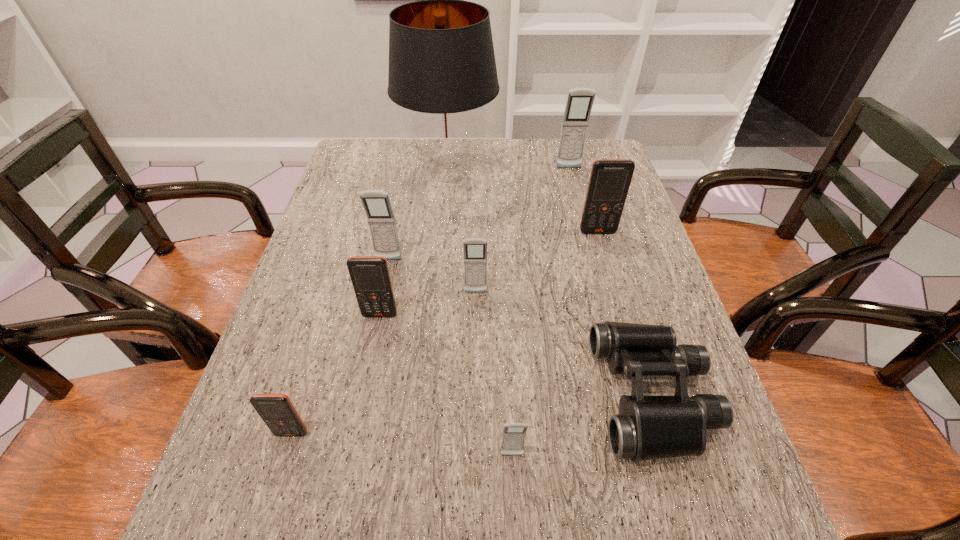
The image size is (960, 540). Identify the location of vacant area that lies between the third smallest gray cellular telephone and the sixth farthest cellular telephone. (340, 347).

Locate an element on the screen. free area in between the shortest object and the third nearest cellular telephone is located at coordinates (516, 355).

You are a GUI agent. You are given a task and a screenshot of the screen. Output one action in this format:
    pyautogui.click(x=<x>, y=<y>)
    Task: Click on the empty location between the fourth farthest cellular telephone and the tallest object
    
    Given the screenshot: What is the action you would take?
    pyautogui.click(x=462, y=233)

Find the location of `vacant space that is in between the smallest orange cellular telephone and the second nearest orange cellular telephone`. vacant space that is in between the smallest orange cellular telephone and the second nearest orange cellular telephone is located at coordinates (336, 374).

At what (x,y) coordinates should I click in order to perform the action: click on free space between the second biggest orange cellular telephone and the shortest object. Please return your answer as a coordinate pair (x, y). The image size is (960, 540). Looking at the image, I should click on (516, 355).

At what (x,y) coordinates should I click in order to perform the action: click on blank region between the third farthest cellular telephone and the third gray cellular telephone from left to right. Please return your answer as a coordinate pair (x, y). The height and width of the screenshot is (540, 960). Looking at the image, I should click on coord(450,358).

At what (x,y) coordinates should I click in order to perform the action: click on vacant area that lies between the binoculars and the lampshade. Please return your answer as a coordinate pair (x, y). Image resolution: width=960 pixels, height=540 pixels. Looking at the image, I should click on (551, 284).

This screenshot has height=540, width=960. Find the location of `free space between the leftmost cellular telephone and the shortest object`. free space between the leftmost cellular telephone and the shortest object is located at coordinates (472, 414).

I want to click on empty space between the third farthest object and the third nearest gray cellular telephone, so click(x=493, y=246).

Identify which object is the eighth nearest to the second biggest orange cellular telephone. Please provide its 2D coordinates. Your answer should be formatted as a tuple, i.e. [(x, y)], where the tuple contains the x and y coordinates of a point satisfying the conditions above.

[(579, 103)]